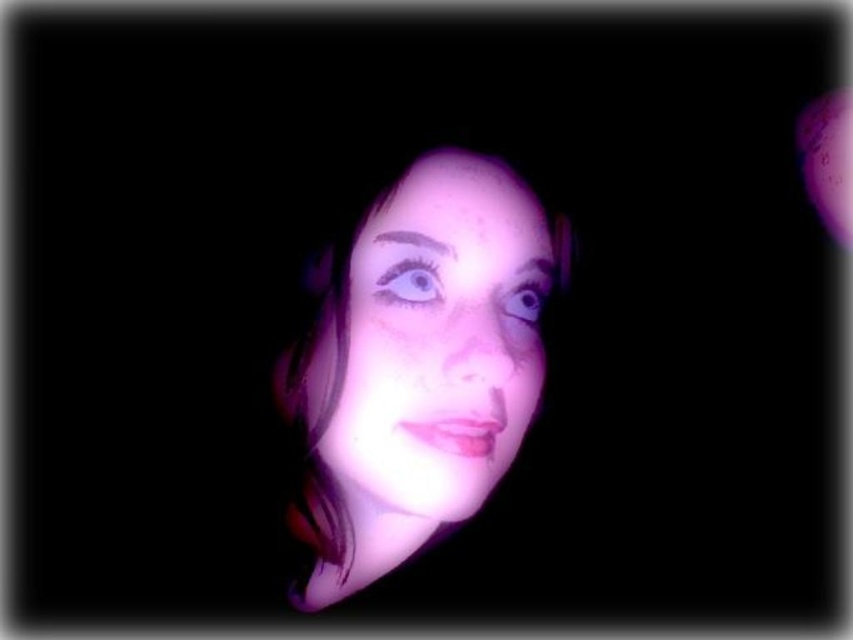
Question: Does purple glossy eye at upper center appear on the right side of shiny blue eye at center?

Choices:
 (A) yes
 (B) no

Answer: (B)

Question: Which point is farther to the camera?

Choices:
 (A) (419, 291)
 (B) (525, 291)
 (C) (426, 323)

Answer: (B)

Question: Which object appears farthest from the camera in this image?

Choices:
 (A) shiny blue eye at center
 (B) purple matte face at center
 (C) purple glossy eye at upper center

Answer: (A)

Question: Is purple matte face at center above shiny blue eye at center?

Choices:
 (A) no
 (B) yes

Answer: (A)

Question: Can you confirm if purple glossy eye at upper center is positioned above shiny blue eye at center?

Choices:
 (A) no
 (B) yes

Answer: (B)

Question: Which object is positioned farthest from the purple glossy eye at upper center?

Choices:
 (A) purple matte face at center
 (B) shiny blue eye at center

Answer: (B)